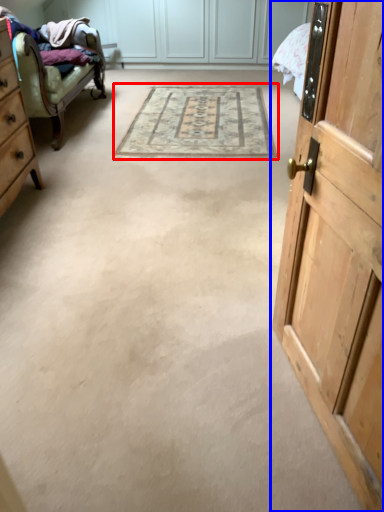
Question: Which object appears farthest to the camera in this image, mat (highlighted by a red box) or door (highlighted by a blue box)?

Choices:
 (A) mat
 (B) door

Answer: (A)